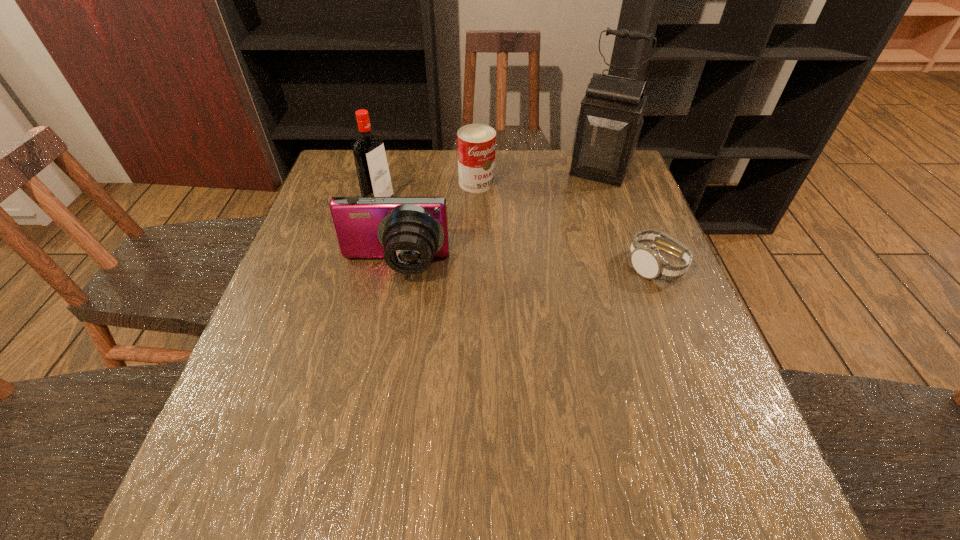
At what (x,y) coordinates should I click in order to perform the action: click on vacant space located on the front-facing side of the lantern. Please return your answer as a coordinate pair (x, y). The image size is (960, 540). Looking at the image, I should click on (572, 224).

At what (x,y) coordinates should I click in order to perform the action: click on free spot located 0.360m on the front and back of the second tallest object. Please return your answer as a coordinate pair (x, y). This screenshot has width=960, height=540. Looking at the image, I should click on (503, 256).

Where is `blank area located 0.080m on the front and back of the second tallest object`? blank area located 0.080m on the front and back of the second tallest object is located at coordinates (413, 218).

Identify the location of vacant area situated 0.400m on the front and back of the second tallest object. This screenshot has width=960, height=540. (516, 263).

Locate an element on the screen. The image size is (960, 540). vacant region located on the front label of the can is located at coordinates (497, 205).

Find the location of a particular element. free space located on the front label of the can is located at coordinates (547, 261).

This screenshot has height=540, width=960. Find the location of `free space located on the front label of the can`. free space located on the front label of the can is located at coordinates (498, 207).

You are a GUI agent. You are given a task and a screenshot of the screen. Output one action in this format:
    pyautogui.click(x=<x>, y=<y>)
    Task: Click on the lantern located at the far edge
    This screenshot has height=540, width=960.
    Given the screenshot: What is the action you would take?
    pyautogui.click(x=608, y=127)

Where is `vodka located at the far edge`? The width and height of the screenshot is (960, 540). vodka located at the far edge is located at coordinates (373, 174).

At what (x,y) coordinates should I click in order to perform the action: click on can that is positioned at the far edge. Please return your answer as a coordinate pair (x, y). This screenshot has height=540, width=960. Looking at the image, I should click on (476, 143).